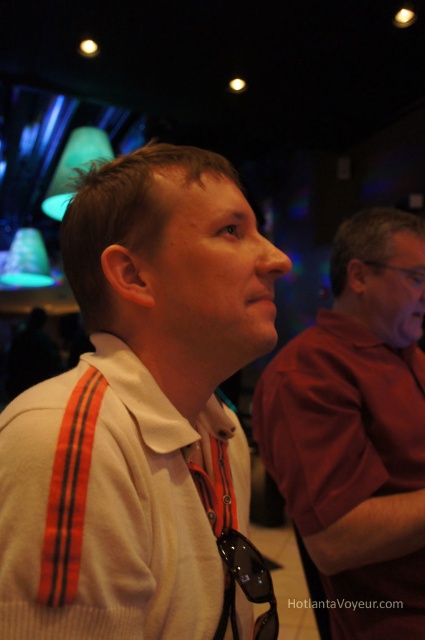
You are organizing a clothing store and need to arrange the white knit sweater at center and white matte shirt at center on a rack. Which item should you place on the narrower hanger since it is smaller in width?

The white knit sweater at center should be placed on the narrower hanger because its width is less than the white matte shirt at center.

You are organizing a clothing display and need to arrange the white knit sweater at center and the white matte shirt at center based on their positions in the image. Which one should you place higher up on the display rack?

The white knit sweater at center should be placed higher up on the display rack since it is located above the white matte shirt at center in the image.